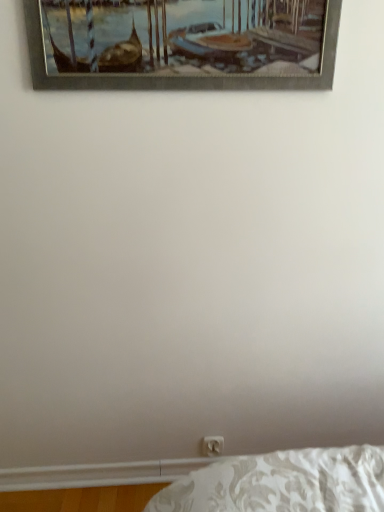
Question: Do you think white plastic electric outlet at lower center is within metallic silver picture frame at upper center, or outside of it?

Choices:
 (A) inside
 (B) outside

Answer: (B)

Question: From a real-world perspective, is white plastic electric outlet at lower center above or below metallic silver picture frame at upper center?

Choices:
 (A) above
 (B) below

Answer: (B)

Question: Looking at the image, does white plastic electric outlet at lower center seem bigger or smaller compared to metallic silver picture frame at upper center?

Choices:
 (A) big
 (B) small

Answer: (B)

Question: Considering the positions of metallic silver picture frame at upper center and white plastic electric outlet at lower center in the image, is metallic silver picture frame at upper center bigger or smaller than white plastic electric outlet at lower center?

Choices:
 (A) big
 (B) small

Answer: (A)

Question: From a real-world perspective, is metallic silver picture frame at upper center positioned above or below white plastic electric outlet at lower center?

Choices:
 (A) below
 (B) above

Answer: (B)

Question: Choose the correct answer: Is metallic silver picture frame at upper center inside white plastic electric outlet at lower center or outside it?

Choices:
 (A) outside
 (B) inside

Answer: (A)

Question: Is metallic silver picture frame at upper center taller or shorter than white plastic electric outlet at lower center?

Choices:
 (A) short
 (B) tall

Answer: (B)